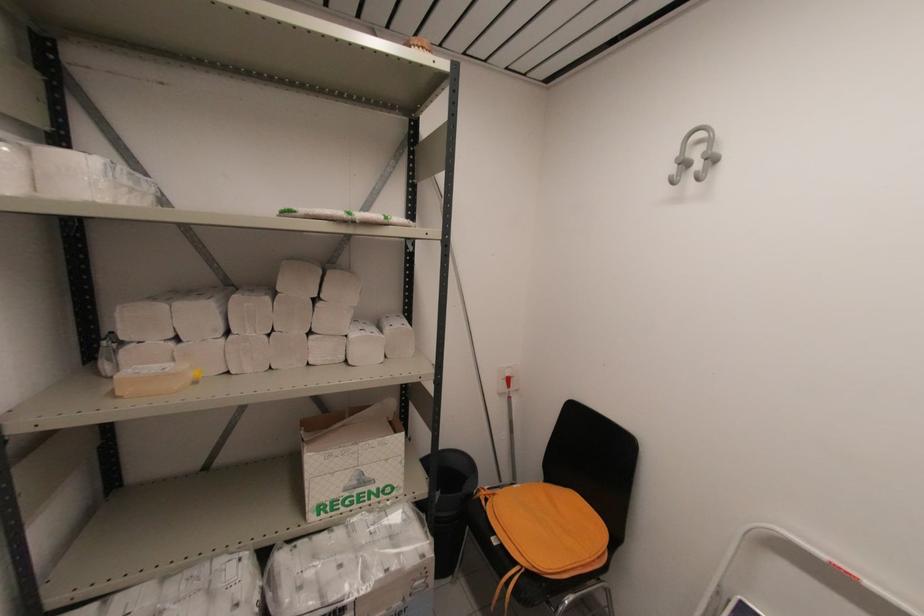
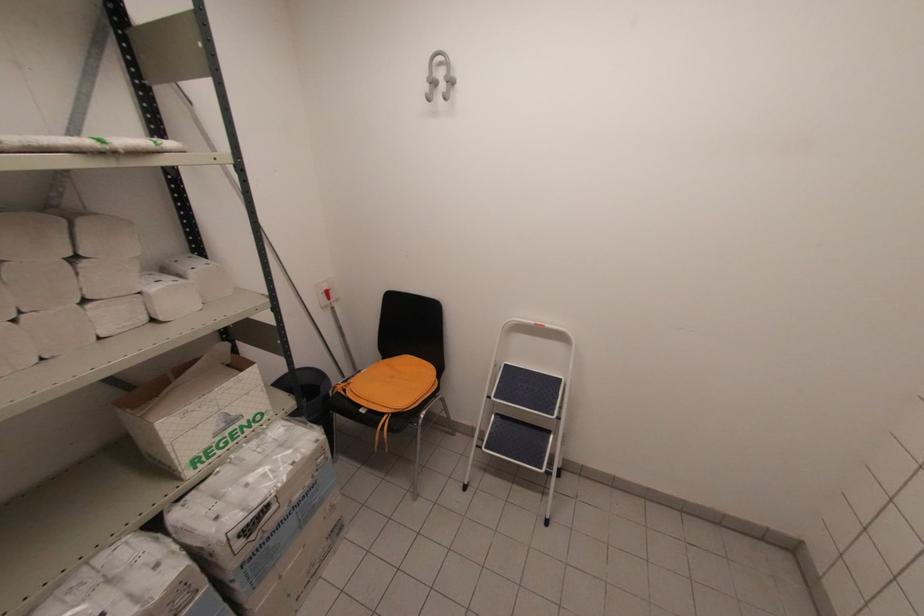
Locate, in the second image, the point that corresponds to pixel 516 485 in the first image.

(362, 371)